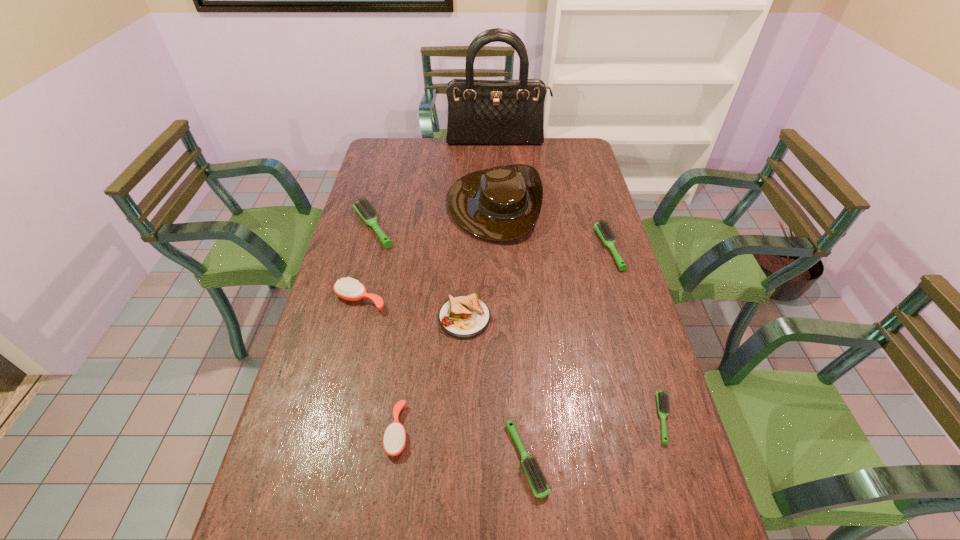
The width and height of the screenshot is (960, 540). I want to click on the fourth closest light hairbrush to the bigger orange hairbrush, so click(662, 398).

Where is `light hairbrush object that ranks as the closest to the second smallest light hairbrush`? This screenshot has height=540, width=960. light hairbrush object that ranks as the closest to the second smallest light hairbrush is located at coordinates (662, 398).

At what (x,y) coordinates should I click in order to perform the action: click on vacant space that satisfies the following two spatial constraints: 1. on the back side of the third hairbrush from left to right; 2. on the right side of the beige sandwich. Please return your answer as a coordinate pair (x, y). This screenshot has height=540, width=960. Looking at the image, I should click on (413, 318).